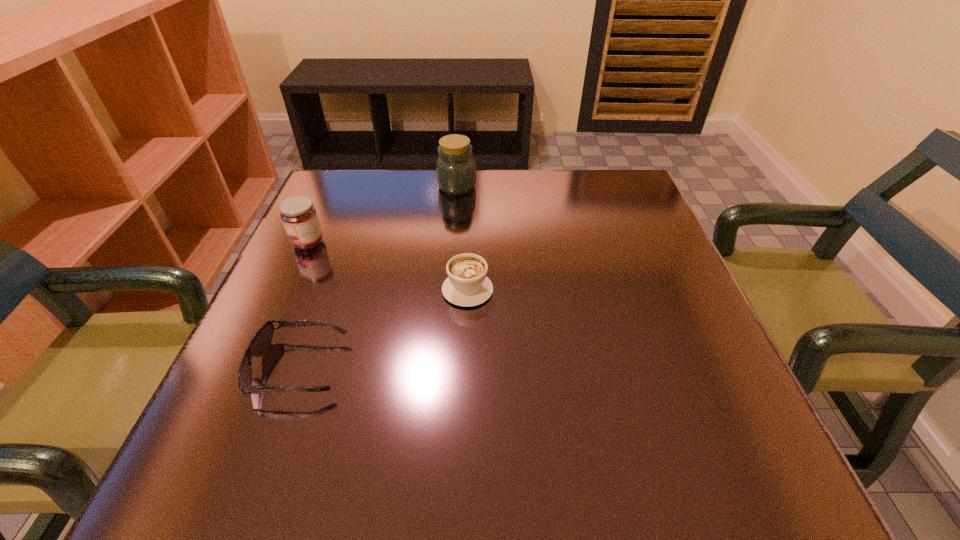
This screenshot has height=540, width=960. I want to click on free space located 0.060m to the right of the cappuccino's handle, so click(x=468, y=252).

I want to click on free spot located 0.350m to the right of the cappuccino's handle, so click(470, 181).

This screenshot has height=540, width=960. I want to click on vacant position located 0.150m to the right of the cappuccino's handle, so click(x=469, y=227).

Locate an element on the screen. This screenshot has height=540, width=960. vacant area situated 0.210m on the front-facing side of the nearest object is located at coordinates (470, 367).

This screenshot has width=960, height=540. Identify the location of object located at the far edge. (456, 170).

Where is `jam that is at the left edge`? The height and width of the screenshot is (540, 960). jam that is at the left edge is located at coordinates (299, 216).

Where is `sunglasses present at the left edge`? This screenshot has width=960, height=540. sunglasses present at the left edge is located at coordinates (262, 339).

Where is `vacant space at the far edge of the desktop`? This screenshot has width=960, height=540. vacant space at the far edge of the desktop is located at coordinates (555, 177).

The width and height of the screenshot is (960, 540). In order to click on free region at the near edge of the desktop in this screenshot , I will do `click(595, 477)`.

Where is `free space at the left edge`? Image resolution: width=960 pixels, height=540 pixels. free space at the left edge is located at coordinates (297, 267).